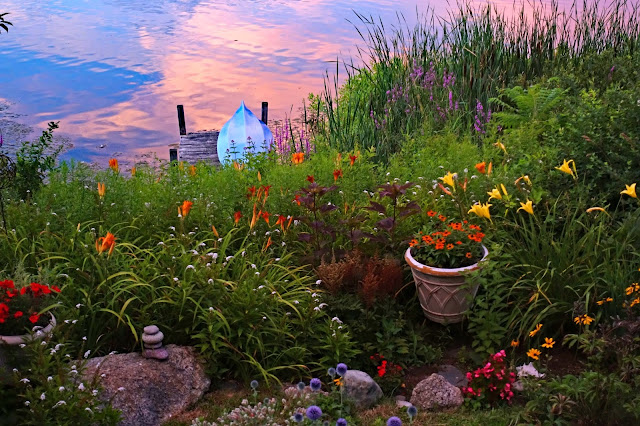
Find the location of `plant vase`. plant vase is located at coordinates (447, 287).